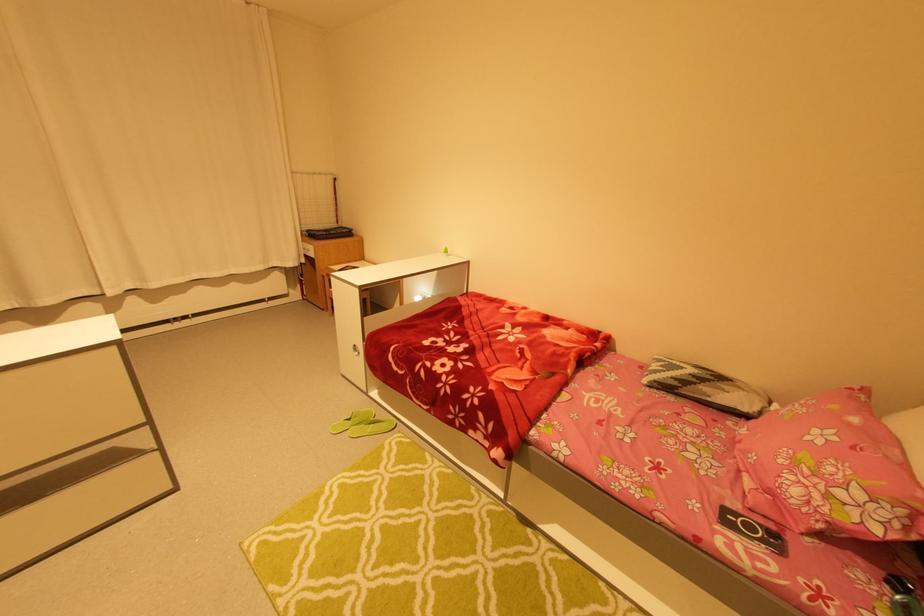
The location [751,530] corresponds to which object?

It corresponds to the phone in the image.